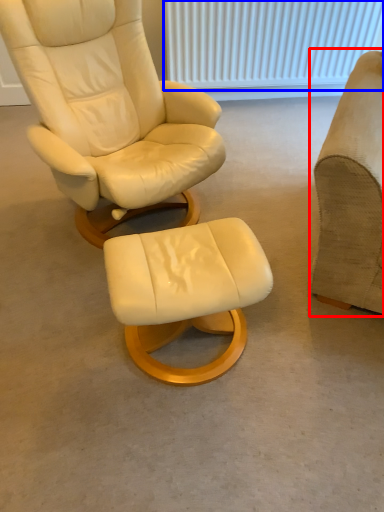
Question: Which object appears closest to the camera in this image, chair (highlighted by a red box) or radiator (highlighted by a blue box)?

Choices:
 (A) chair
 (B) radiator

Answer: (A)